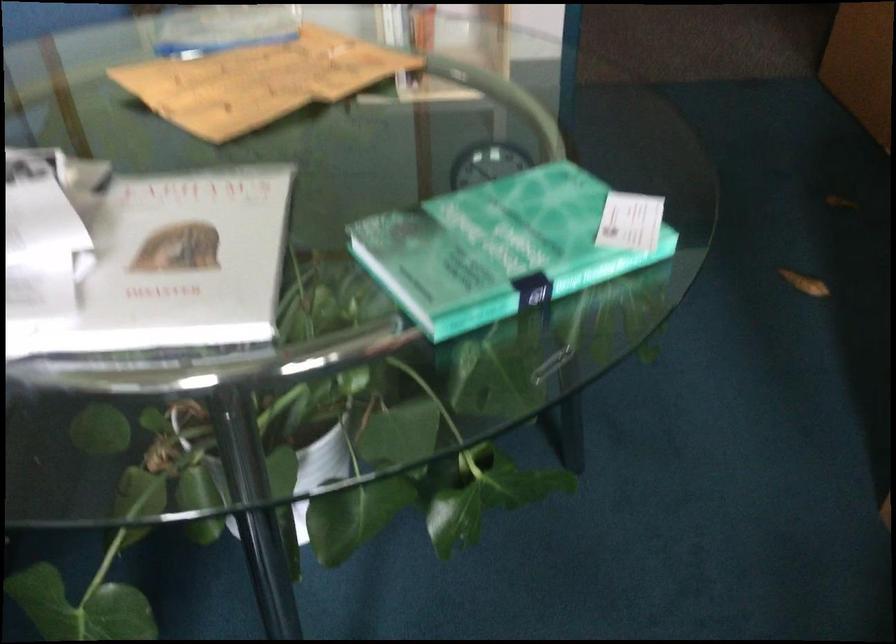
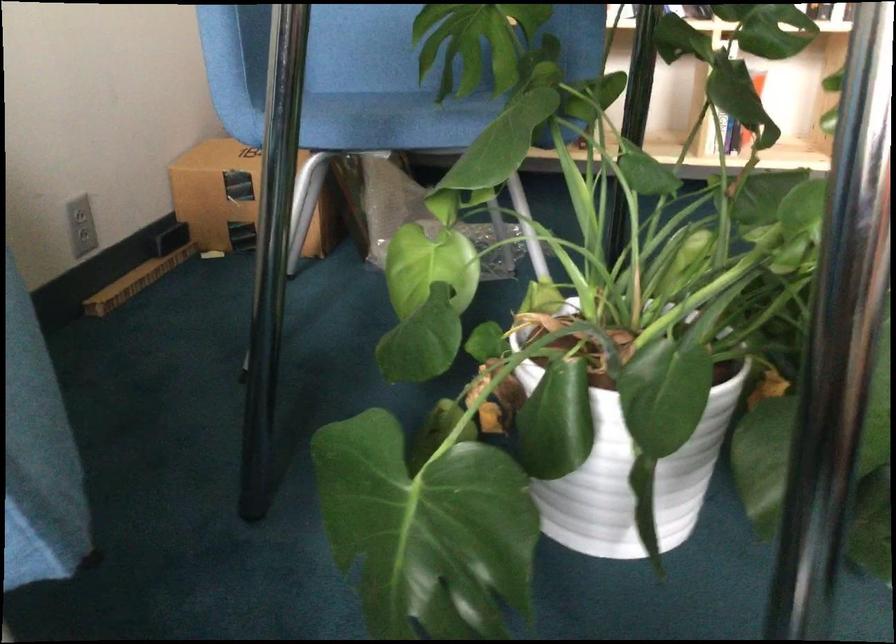
Question: How did the camera likely rotate?

Choices:
 (A) Left
 (B) Right
 (C) Up
 (D) Down

Answer: (C)